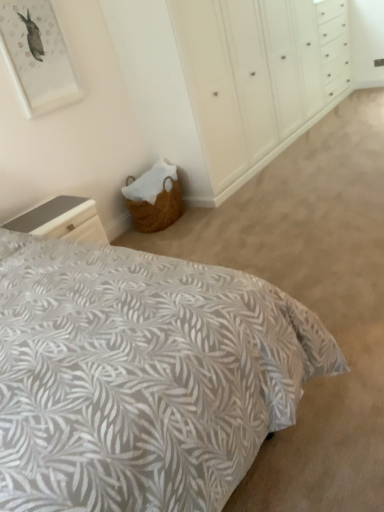
Question: Is the position of matte white picture frame at upper left more distant than that of smooth gray nightstand at lower left?

Choices:
 (A) no
 (B) yes

Answer: (B)

Question: Does matte white picture frame at upper left contain smooth gray nightstand at lower left?

Choices:
 (A) no
 (B) yes

Answer: (A)

Question: From a real-world perspective, is matte white picture frame at upper left positioned under smooth gray nightstand at lower left based on gravity?

Choices:
 (A) no
 (B) yes

Answer: (A)

Question: Could you tell me if matte white picture frame at upper left is turned towards smooth gray nightstand at lower left?

Choices:
 (A) no
 (B) yes

Answer: (A)

Question: From the image's perspective, is matte white picture frame at upper left under smooth gray nightstand at lower left?

Choices:
 (A) yes
 (B) no

Answer: (B)

Question: Would you say matte white picture frame at upper left is to the left or to the right of leaf-patterned fabric bed at lower left in the picture?

Choices:
 (A) left
 (B) right

Answer: (A)

Question: From a real-world perspective, is matte white picture frame at upper left above or below leaf-patterned fabric bed at lower left?

Choices:
 (A) below
 (B) above

Answer: (B)

Question: Is matte white picture frame at upper left in front of or behind leaf-patterned fabric bed at lower left in the image?

Choices:
 (A) behind
 (B) front

Answer: (A)

Question: Is matte white picture frame at upper left bigger or smaller than leaf-patterned fabric bed at lower left?

Choices:
 (A) small
 (B) big

Answer: (A)

Question: From their relative heights in the image, would you say woven basket at lower left is taller or shorter than matte white picture frame at upper left?

Choices:
 (A) short
 (B) tall

Answer: (B)

Question: Choose the correct answer: Is woven basket at lower left inside matte white picture frame at upper left or outside it?

Choices:
 (A) inside
 (B) outside

Answer: (B)

Question: From the image's perspective, is woven basket at lower left located above or below matte white picture frame at upper left?

Choices:
 (A) above
 (B) below

Answer: (A)

Question: Visually, is woven basket at lower left positioned to the left or to the right of matte white picture frame at upper left?

Choices:
 (A) right
 (B) left

Answer: (A)

Question: In terms of size, does leaf-patterned fabric bed at lower left appear bigger or smaller than woven basket at lower left?

Choices:
 (A) small
 (B) big

Answer: (A)

Question: Visually, is leaf-patterned fabric bed at lower left positioned to the left or to the right of woven basket at lower left?

Choices:
 (A) left
 (B) right

Answer: (B)